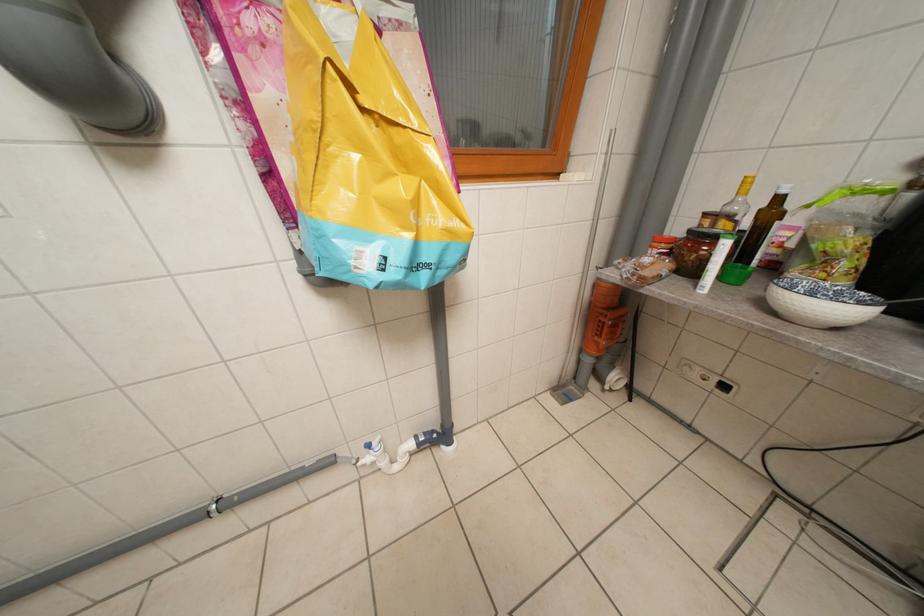
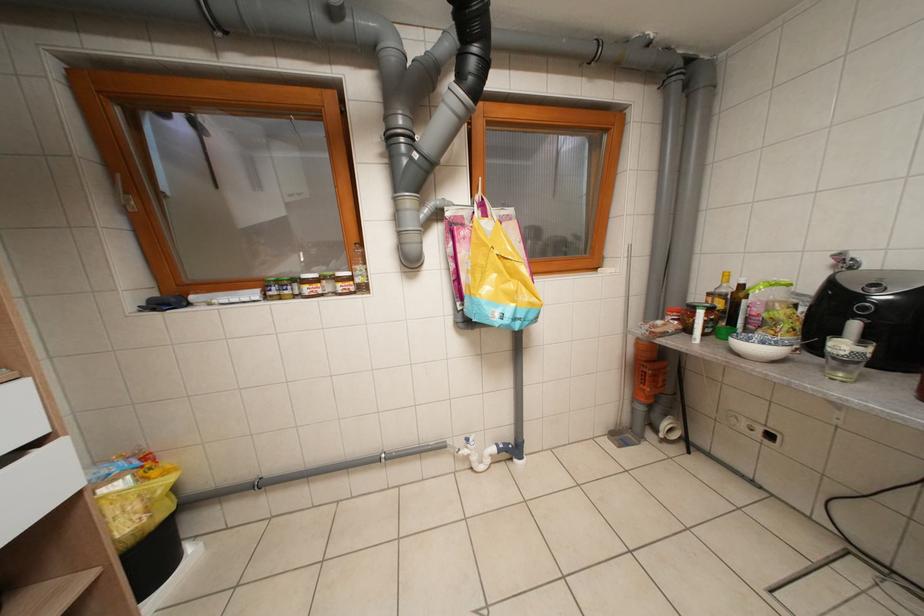
Question: The first image is from the beginning of the video and the second image is from the end. How did the camera likely rotate when shooting the video?

Choices:
 (A) Left
 (B) Right
 (C) Up
 (D) Down

Answer: (C)